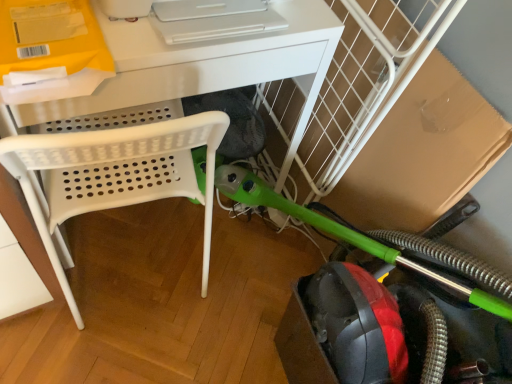
Question: Which is correct: white plastic desk at upper center is inside green rubber garden hose at lower right, or outside of it?

Choices:
 (A) inside
 (B) outside

Answer: (B)

Question: Considering the positions of white plastic desk at upper center and green rubber garden hose at lower right in the image, is white plastic desk at upper center bigger or smaller than green rubber garden hose at lower right?

Choices:
 (A) small
 (B) big

Answer: (B)

Question: Considering the positions of white plastic desk at upper center and green rubber garden hose at lower right in the image, is white plastic desk at upper center taller or shorter than green rubber garden hose at lower right?

Choices:
 (A) short
 (B) tall

Answer: (B)

Question: Would you say green rubber garden hose at lower right is inside or outside white plastic desk at upper center?

Choices:
 (A) inside
 (B) outside

Answer: (B)

Question: From the image's perspective, relative to white plastic desk at upper center, is green rubber garden hose at lower right above or below?

Choices:
 (A) above
 (B) below

Answer: (B)

Question: From their relative heights in the image, would you say green rubber garden hose at lower right is taller or shorter than white plastic desk at upper center?

Choices:
 (A) tall
 (B) short

Answer: (B)

Question: From a real-world perspective, relative to white plastic desk at upper center, is green rubber garden hose at lower right vertically above or below?

Choices:
 (A) below
 (B) above

Answer: (A)